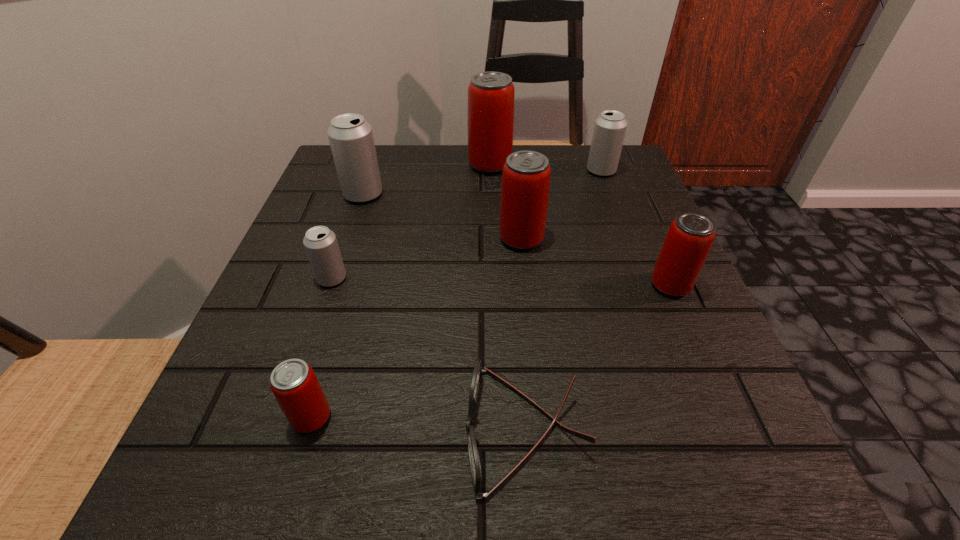
Find the location of a particular element. The image size is (960, 540). the smallest white beer can is located at coordinates (320, 243).

The image size is (960, 540). I want to click on the smallest pink beer can, so click(x=294, y=384).

Where is `the leftmost pink beer can`? The image size is (960, 540). the leftmost pink beer can is located at coordinates (294, 384).

Locate an element on the screen. This screenshot has height=540, width=960. the shortest object is located at coordinates (475, 467).

This screenshot has width=960, height=540. In order to click on vacant area situated on the right of the tallest object in this screenshot , I will do `click(533, 165)`.

Locate an element on the screen. The width and height of the screenshot is (960, 540). free space located 0.070m on the back of the fourth nearest beer can is located at coordinates (517, 205).

Where is `vacant point located 0.220m on the right of the fifth nearest beer can`? vacant point located 0.220m on the right of the fifth nearest beer can is located at coordinates (486, 194).

The height and width of the screenshot is (540, 960). What are the coordinates of `vacant space located 0.180m on the left of the rightmost white beer can` in the screenshot? It's located at (508, 171).

Locate an element on the screen. free point located 0.180m on the left of the rightmost pink beer can is located at coordinates (543, 286).

Where is `vacant space positioned on the right of the nearest white beer can`? This screenshot has height=540, width=960. vacant space positioned on the right of the nearest white beer can is located at coordinates (498, 278).